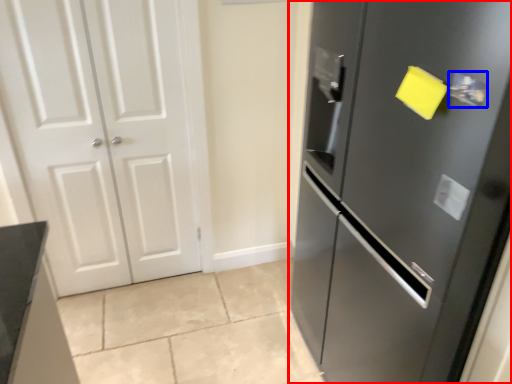
Question: Which of the following is the farthest to the observer, door (highlighted by a red box) or door handle (highlighted by a blue box)?

Choices:
 (A) door
 (B) door handle

Answer: (B)